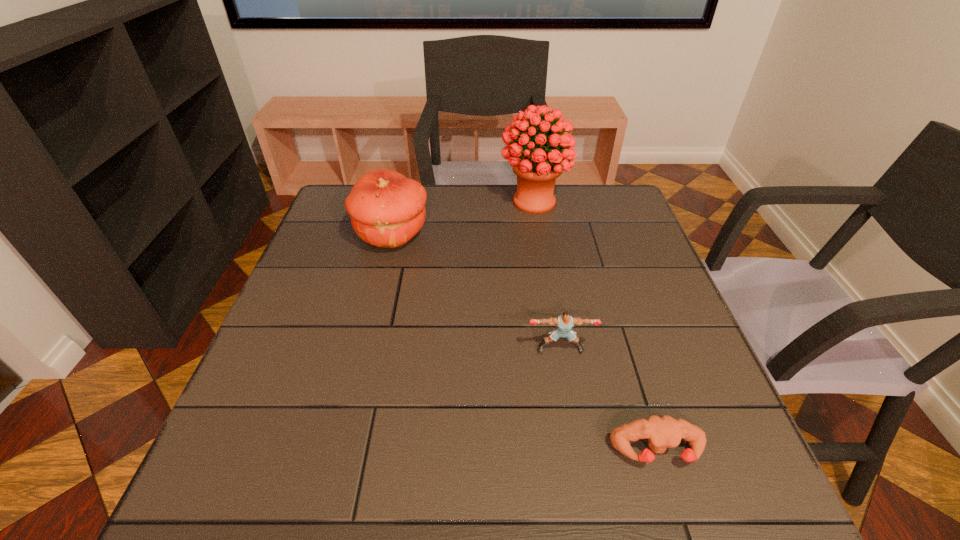
You are a GUI agent. You are given a task and a screenshot of the screen. Output one action in this format:
    pyautogui.click(x=<x>, y=<y>)
    Task: Click on the free space at the far left corner of the desktop
    The image size is (960, 540).
    Given the screenshot: What is the action you would take?
    pyautogui.click(x=343, y=201)

Identify the location of free space at the far right corner of the desktop. (612, 203).

Where is `free spot between the nearest object and the farther puncher`? This screenshot has width=960, height=540. free spot between the nearest object and the farther puncher is located at coordinates (609, 400).

Image resolution: width=960 pixels, height=540 pixels. Find the location of `empty space that is in between the nearer puncher and the bouquet`. empty space that is in between the nearer puncher and the bouquet is located at coordinates (595, 326).

Locate an element on the screen. free space between the taller puncher and the bouquet is located at coordinates (547, 275).

The width and height of the screenshot is (960, 540). Identify the location of free spot between the bouquet and the farther puncher. (547, 275).

Where is `vacant space in between the tallest object and the second shortest object`? This screenshot has height=540, width=960. vacant space in between the tallest object and the second shortest object is located at coordinates (547, 275).

The image size is (960, 540). I want to click on empty space between the bouquet and the pumpkin, so click(463, 218).

This screenshot has height=540, width=960. Identify the location of vacant region between the second nearest object and the pumpkin. (476, 292).

The height and width of the screenshot is (540, 960). In order to click on free space between the tallest object and the taller puncher in this screenshot , I will do `click(547, 275)`.